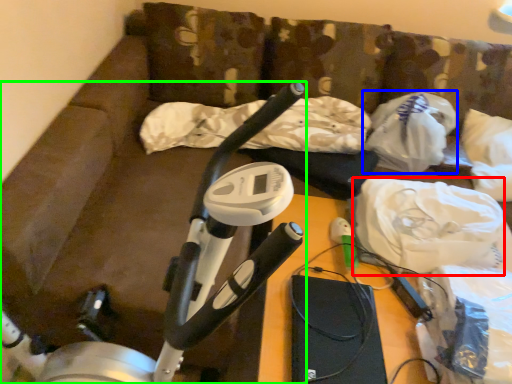
Question: Considering the real-world distances, which object is closest to material (highlighted by a red box)? plastic bag (highlighted by a blue box) or stationary bicycle (highlighted by a green box).

Choices:
 (A) plastic bag
 (B) stationary bicycle

Answer: (A)